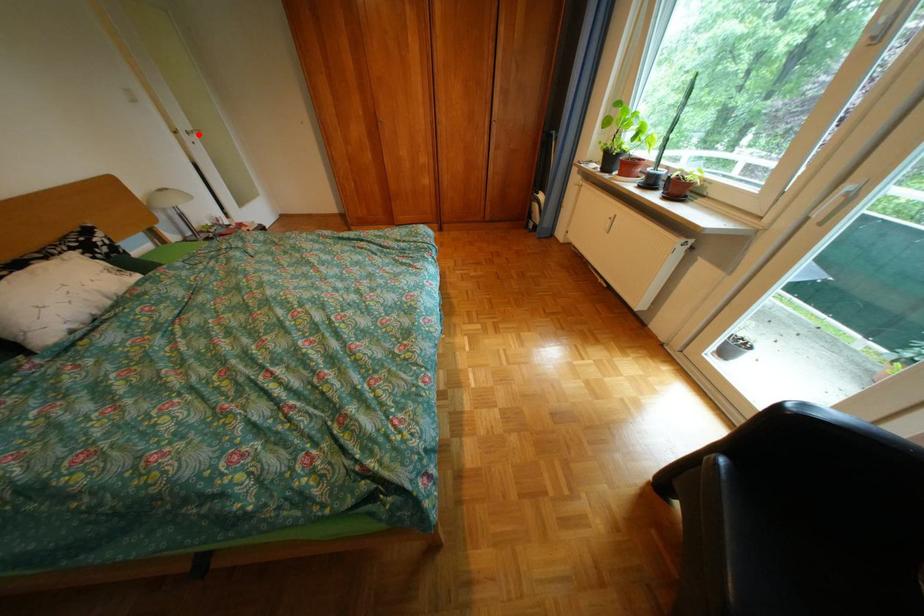
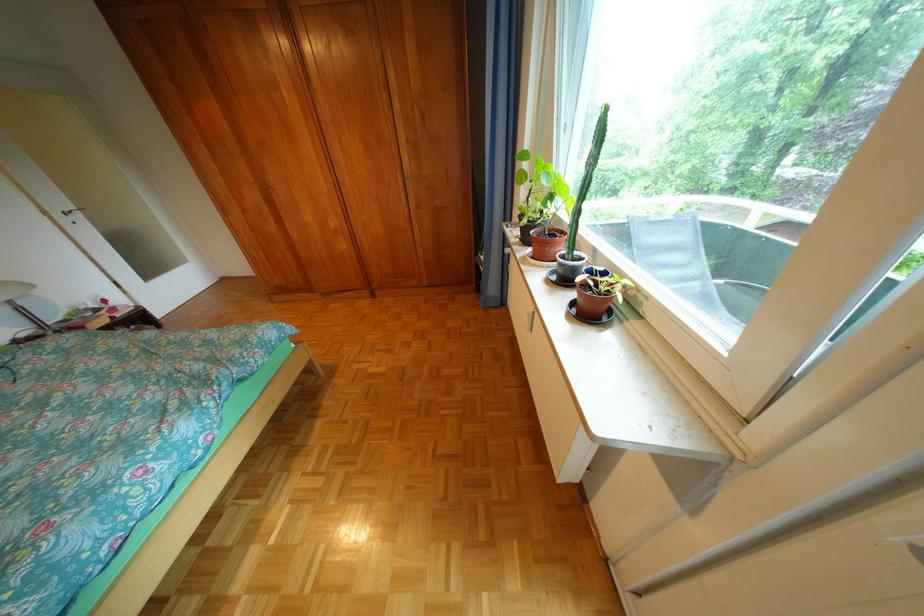
Question: I am providing you with two images of the same scene from different viewpoints. A red point is shown in image1. For the corresponding object point in image2, is it positioned nearer or farther from the camera?

Choices:
 (A) Nearer
 (B) Farther

Answer: (B)